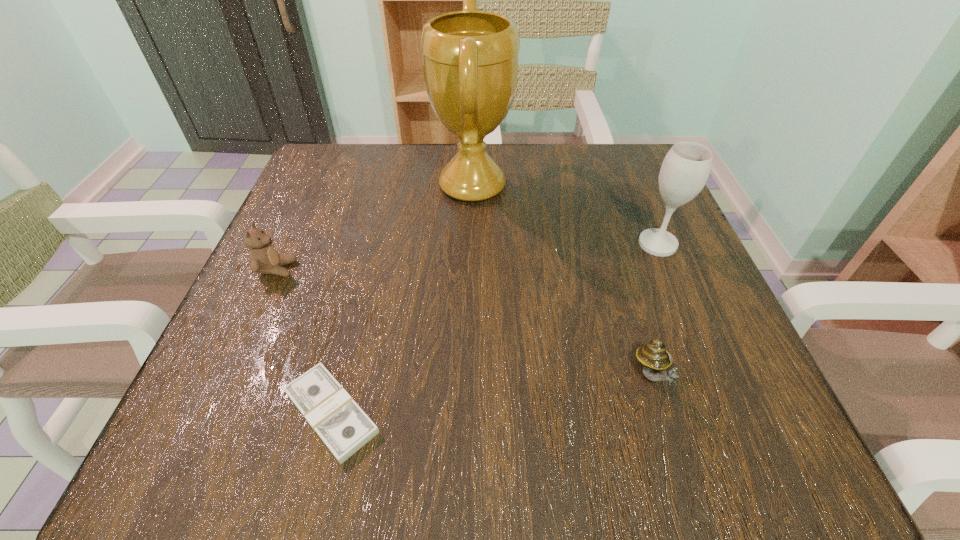
What are the coordinates of `award` in the screenshot? It's located at (470, 58).

Find the location of `the third object from left to right`. the third object from left to right is located at coordinates (470, 58).

You are a GUI agent. You are given a task and a screenshot of the screen. Output one action in this format:
    pyautogui.click(x=<x>, y=<y>)
    Task: Click on the second tallest object
    The width and height of the screenshot is (960, 540).
    Given the screenshot: What is the action you would take?
    pyautogui.click(x=686, y=167)

Identify the location of the rightmost object. (686, 167).

Locate an element on the screen. teddy bear is located at coordinates (264, 259).

I want to click on the fourth object from left to right, so click(654, 358).

Identify the location of dollar. The image size is (960, 540). (342, 425).

Where is `the shortest object`? Image resolution: width=960 pixels, height=540 pixels. the shortest object is located at coordinates (342, 425).

The width and height of the screenshot is (960, 540). I want to click on vacant space situated on the front of the award with the decoration, so click(x=543, y=185).

You are a GUI agent. You are given a task and a screenshot of the screen. Output one action in this format:
    pyautogui.click(x=<x>, y=<y>)
    Task: Click on the vacant position located 0.120m on the back of the fourth shortest object
    
    Given the screenshot: What is the action you would take?
    pyautogui.click(x=637, y=195)